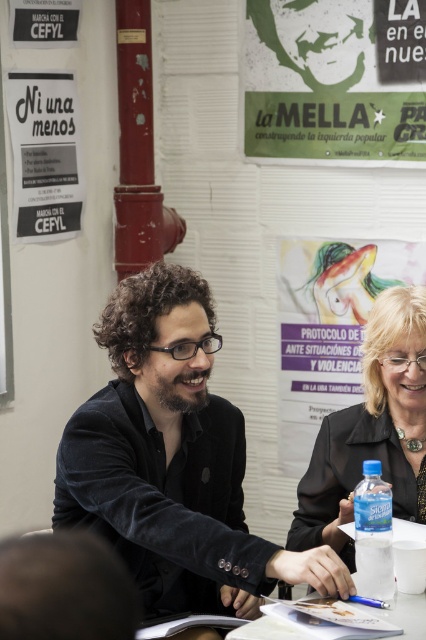
You are an event planner organizing a meeting in this room. You need to place a large banner that requires a wall space larger than the green paper poster at upper center. Is there enough space on the white paper poster at upper left for the banner?

The green paper poster at upper center is larger than the white paper poster at upper left, so the white paper poster at upper left does not have enough space for the banner which requires a larger area than the green paper poster at upper center.

You are a fashion designer who needs to retrieve a velvet black jacket from a table where two people are seated. The jacket is located at point (172, 460). The table has a person on the left and a person on the right. Which direction should you move to reach the jacket first without crossing between the two people?

The velvet black jacket at center is located at point (172, 460). Since the jacket is at the center of the table, you should move towards the middle between the two people to reach it without crossing between them.

You are standing in front of the wall with the posters and notices. There are two points marked on the wall. The first point is at coordinates point (422,324) and the second is at point (265,625). Which point is closer to you?

Point (422,324) is further to the viewer than point (265,625), so the second point is closer to you.